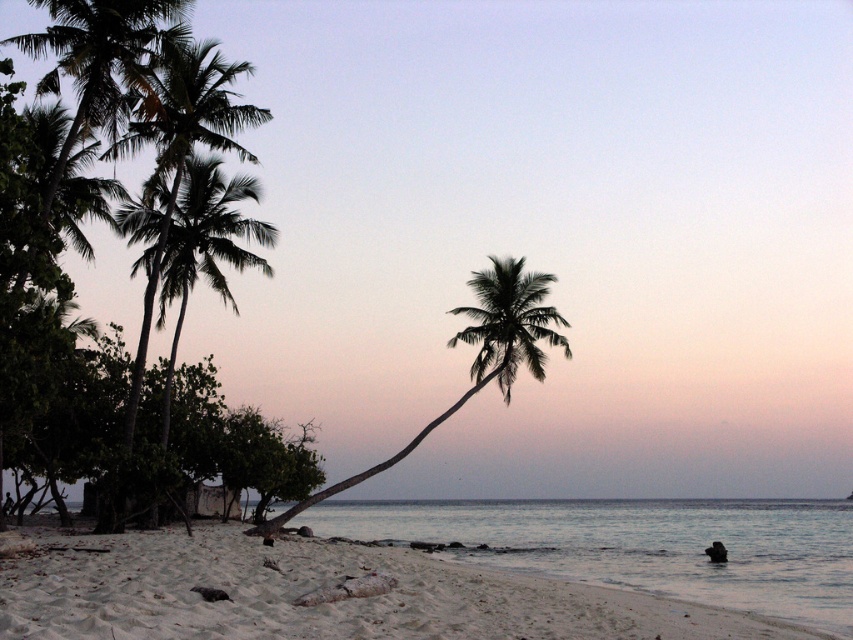
You are standing on the beach and want to take a photo of both the white sandy beach at lower left and the silhouette leafy palm at center. Which object should you frame first in your camera to ensure both are fully visible?

The silhouette leafy palm at center should be framed first because it is larger than the white sandy beach at lower left, so ensuring it fits properly will help accommodate the smaller beach area within the frame.